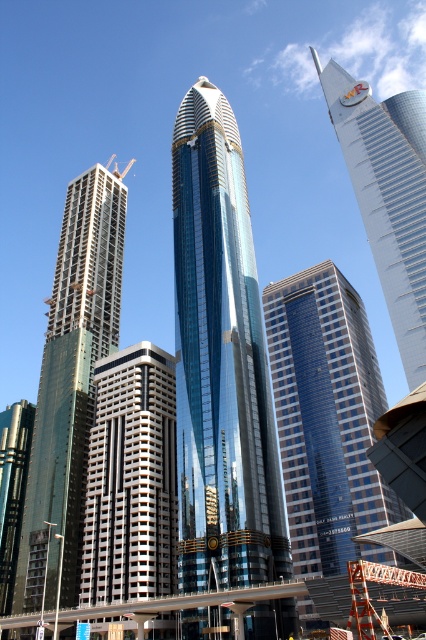
Question: Which point appears farthest from the camera in this image?

Choices:
 (A) (16, 584)
 (B) (117, 172)
 (C) (210, 362)
 (D) (382, 200)

Answer: (B)

Question: Can you confirm if green glass building at left is wider than yellow metallic crane at upper left?

Choices:
 (A) yes
 (B) no

Answer: (B)

Question: Where is glossy glass skyscraper at center located in relation to green glass building at left in the image?

Choices:
 (A) above
 (B) below

Answer: (A)

Question: Observing the image, what is the correct spatial positioning of green glass building at left in reference to yellow metallic crane at upper left?

Choices:
 (A) below
 (B) above

Answer: (A)

Question: Which of the following is the closest to the observer?

Choices:
 (A) [155, 536]
 (B) [351, 522]
 (C) [419, 365]

Answer: (B)

Question: Estimate the real-world distances between objects in this image. Which object is farther from the blue glass building at center?

Choices:
 (A) gray concrete building at center
 (B) glossy glass skyscraper at center

Answer: (A)